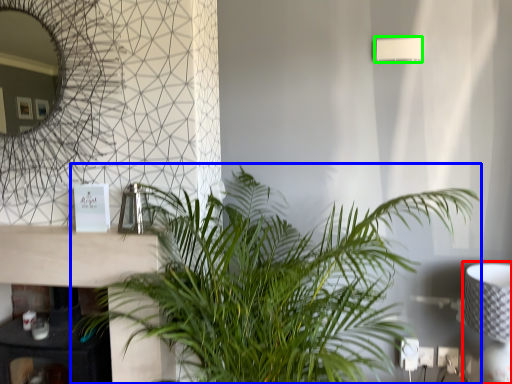
Question: Estimate the real-world distances between objects in this image. Which object is closer to table lamp (highlighted by a red box), houseplant (highlighted by a blue box) or lamp (highlighted by a green box)?

Choices:
 (A) houseplant
 (B) lamp

Answer: (A)